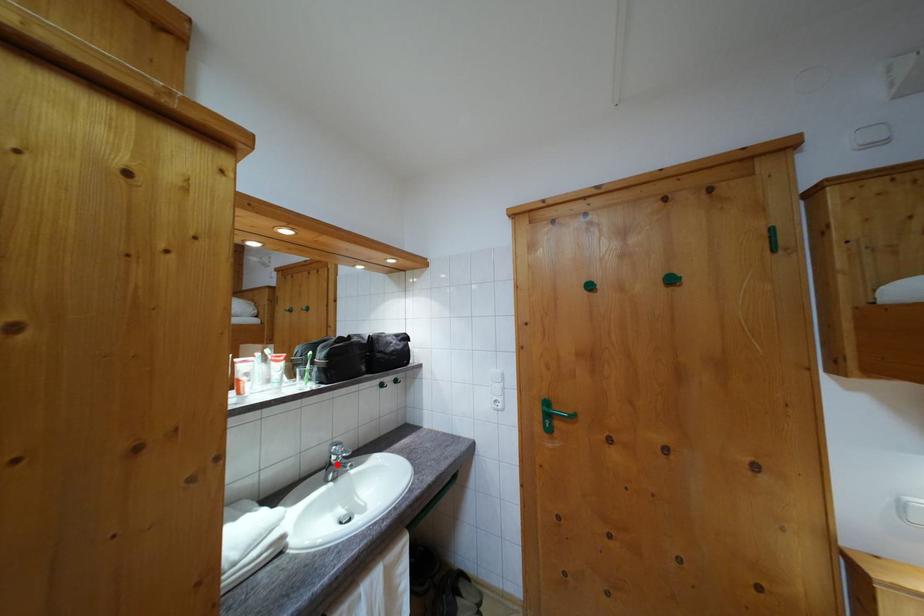
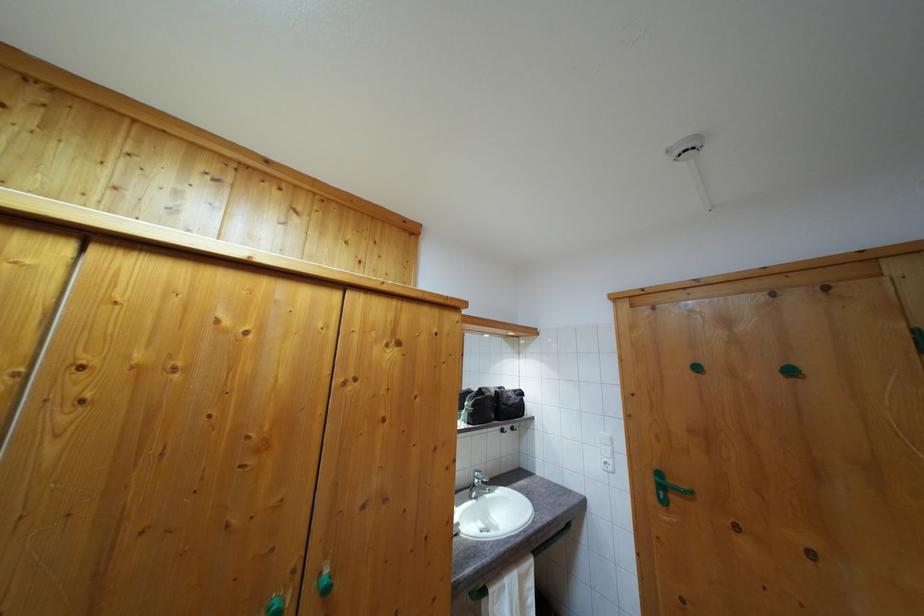
Question: I am providing you with two images of the same scene from different viewpoints. A red point is marked on the first image. At the location where the point appears in image 1, is it still visible in image 2?

Choices:
 (A) Yes
 (B) No

Answer: (A)